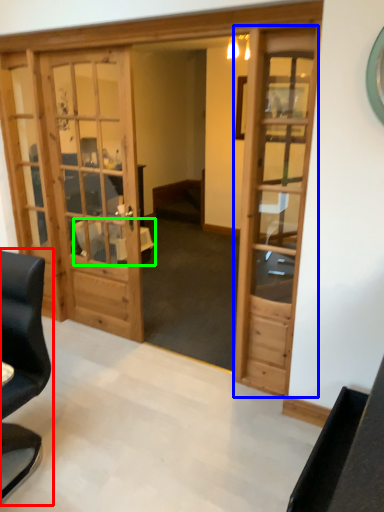
Question: Estimate the real-world distances between objects in this image. Which object is closer to chair (highlighted by a red box), door (highlighted by a blue box) or table (highlighted by a green box)?

Choices:
 (A) door
 (B) table

Answer: (A)